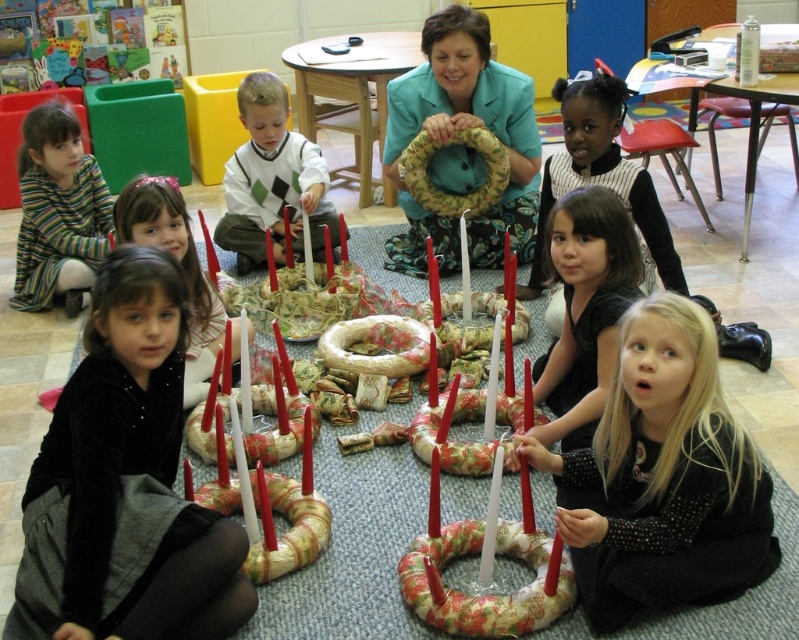
Question: Can you confirm if black textured dress at lower right is positioned above matte green sweater at center?

Choices:
 (A) yes
 (B) no

Answer: (B)

Question: Which point is closer to the camera?

Choices:
 (A) (161, 244)
 (B) (575, 212)
 (C) (124, 561)

Answer: (C)

Question: Can you confirm if floral fabric wreath at center is positioned to the left of striped knit sweater at lower left?

Choices:
 (A) yes
 (B) no

Answer: (B)

Question: Which object appears farthest from the camera in this image?

Choices:
 (A) black textured sweater at lower right
 (B) striped knit sweater at lower left

Answer: (B)

Question: Is black textured dress at lower right smaller than striped knit sweater at lower left?

Choices:
 (A) no
 (B) yes

Answer: (A)

Question: Among these points, which one is nearest to the camera?

Choices:
 (A) (674, 349)
 (B) (460, 84)

Answer: (A)